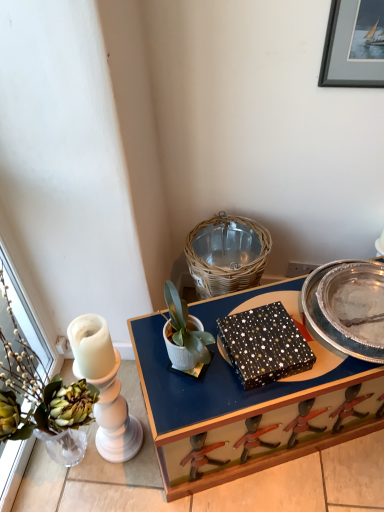
Question: From a real-world perspective, is matte black box at center on silver metallic picture frame at upper right?

Choices:
 (A) no
 (B) yes

Answer: (A)

Question: Can you confirm if matte black box at center is shorter than silver metallic picture frame at upper right?

Choices:
 (A) no
 (B) yes

Answer: (A)

Question: Could you tell me if matte black box at center is turned towards silver metallic picture frame at upper right?

Choices:
 (A) yes
 (B) no

Answer: (B)

Question: Is matte black box at center positioned before silver metallic picture frame at upper right?

Choices:
 (A) yes
 (B) no

Answer: (B)

Question: Does matte black box at center lie behind silver metallic picture frame at upper right?

Choices:
 (A) yes
 (B) no

Answer: (A)

Question: Considering the relative sizes of matte black box at center and silver metallic picture frame at upper right in the image provided, is matte black box at center thinner than silver metallic picture frame at upper right?

Choices:
 (A) yes
 (B) no

Answer: (B)

Question: Could you tell me if silver metallic tray at center-right is facing black textured box at center?

Choices:
 (A) no
 (B) yes

Answer: (A)

Question: Is silver metallic tray at center-right looking in the opposite direction of black textured box at center?

Choices:
 (A) yes
 (B) no

Answer: (B)

Question: Can you confirm if silver metallic tray at center-right is positioned to the right of black textured box at center?

Choices:
 (A) yes
 (B) no

Answer: (A)

Question: Can you confirm if silver metallic tray at center-right is thinner than black textured box at center?

Choices:
 (A) yes
 (B) no

Answer: (B)

Question: Is silver metallic tray at center-right positioned before black textured box at center?

Choices:
 (A) yes
 (B) no

Answer: (B)

Question: Can you confirm if silver metallic tray at center-right is positioned to the left of black textured box at center?

Choices:
 (A) no
 (B) yes

Answer: (A)

Question: Is silver metallic picture frame at upper right at the left side of white matte pot at center?

Choices:
 (A) no
 (B) yes

Answer: (A)